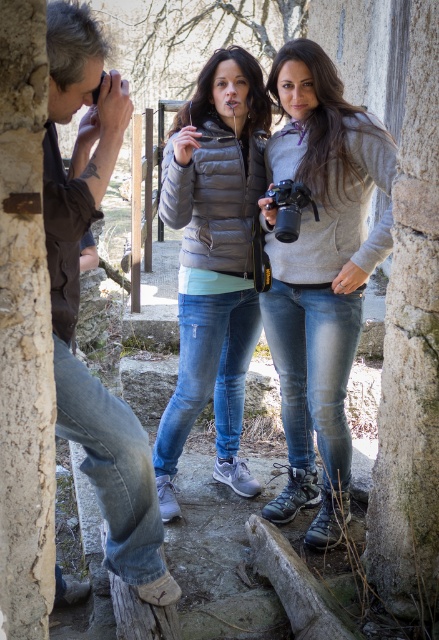
You are a photographer trying to capture the two women in the scene. The gray fleece jacket at center and the matte gray puffer jacket at center are both visible. Which jacket is positioned lower in the frame?

The gray fleece jacket at center is positioned lower in the frame because it is below the matte gray puffer jacket at center.

Based on the scene description, can you determine the exact coordinates of the gray fleece jacket at center?

The gray fleece jacket at center is located at coordinates point (320,275).

Based on the coordinates provided, which object is located at point (78,300)?

The brown leather jacket at left is located at point (78,300).